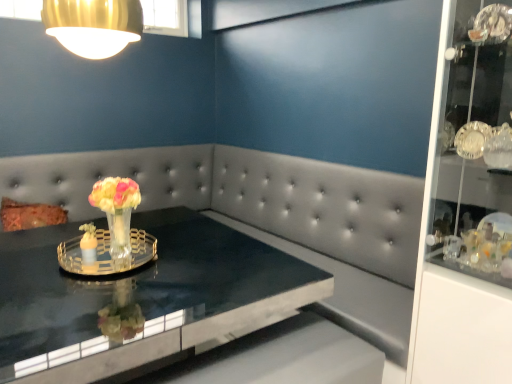
Question: From a real-world perspective, is gold metallic lampshade at upper left physically located above or below clear glass tray at center?

Choices:
 (A) above
 (B) below

Answer: (A)

Question: From the image's perspective, is gold metallic lampshade at upper left above or below clear glass tray at center?

Choices:
 (A) below
 (B) above

Answer: (B)

Question: Which object is the farthest from the gold metallic lampshade at upper left?

Choices:
 (A) translucent glass vase at center
 (B) clear glass tray at center
 (C) black glossy table at center

Answer: (C)

Question: Which object is the closest to the clear glass tray at center?

Choices:
 (A) gold metallic lampshade at upper left
 (B) translucent glass vase at center
 (C) black glossy table at center

Answer: (B)